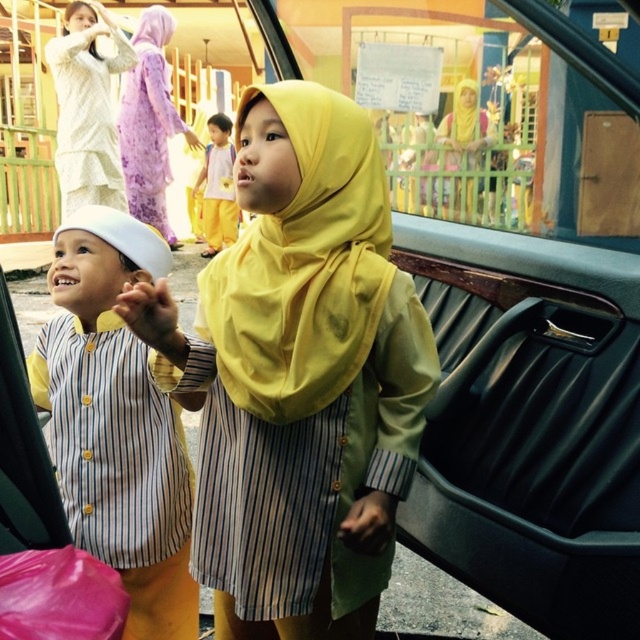
Does matte black car door at lower right have a larger size compared to light purple floral dress at upper left?

No.

Who is positioned more to the left, matte black car door at lower right or light purple floral dress at upper left?

From the viewer's perspective, light purple floral dress at upper left appears more on the left side.

Which is in front, point (525, 474) or point (134, 198)?

Positioned in front is point (525, 474).

What are the coordinates of `matte black car door at lower right` in the screenshot? It's located at (531, 449).

Does point (474, 100) come behind point (93, 330)?

That is False.

Which is behind, point (483, 65) or point (125, 212)?

The point (125, 212) is more distant.

Locate an element on the screen. The height and width of the screenshot is (640, 640). transparent glass car window at upper center is located at coordinates (490, 108).

Which is behind, point (100, 129) or point (216, 138)?

The point (216, 138) is more distant.

Between point (76, 147) and point (200, 170), which one is positioned in front?

Point (76, 147) is in front.

Where is `white lace dress at upper left`? white lace dress at upper left is located at coordinates (86, 108).